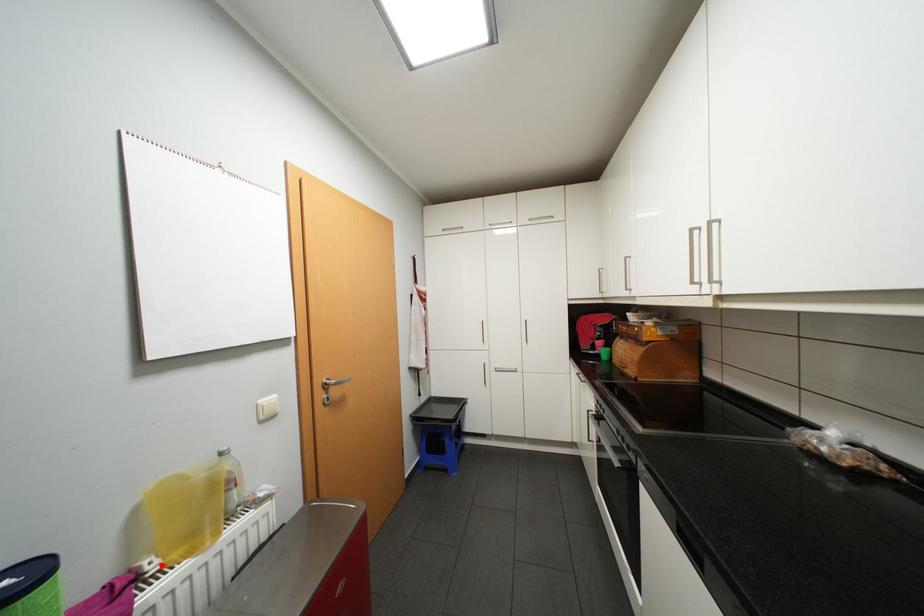
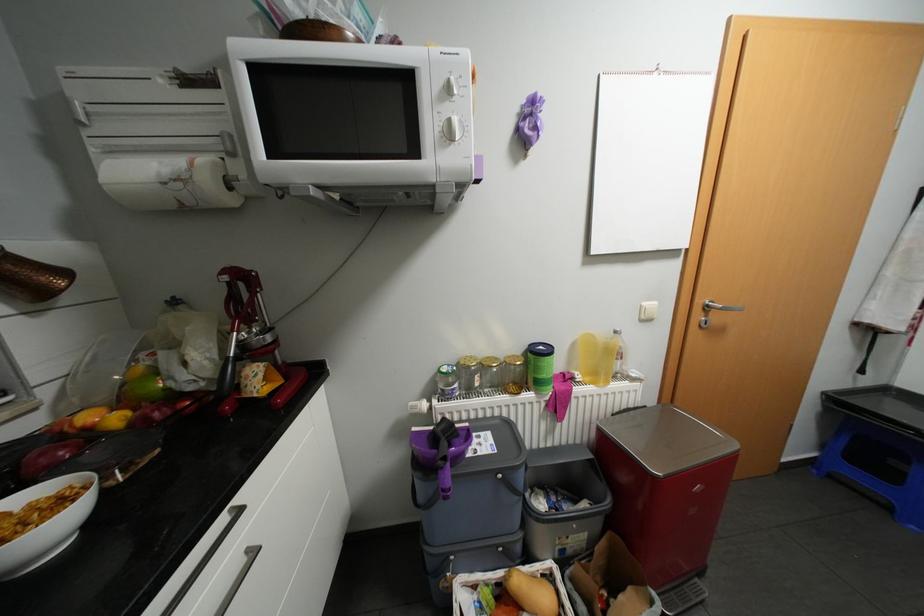
Question: I am providing you with two images of the same scene from different viewpoints. Image1 has a red point marked. In image2, the corresponding 3D location appears at what relative position? Reply with the corresponding letter.

Choices:
 (A) Closer
 (B) Farther

Answer: (B)